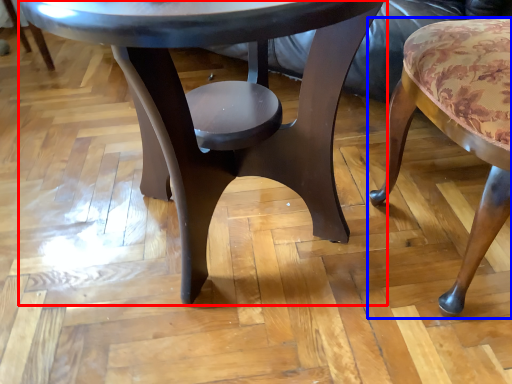
Question: Which point is further to the camera, coffee table (highlighted by a red box) or chair (highlighted by a blue box)?

Choices:
 (A) coffee table
 (B) chair

Answer: (B)